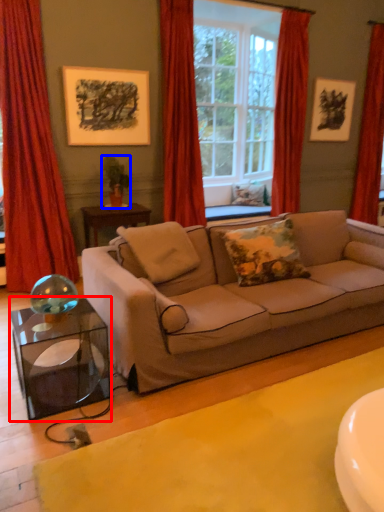
Question: Which of the following is the farthest to the observer, table (highlighted by a red box) or houseplant (highlighted by a blue box)?

Choices:
 (A) table
 (B) houseplant

Answer: (B)